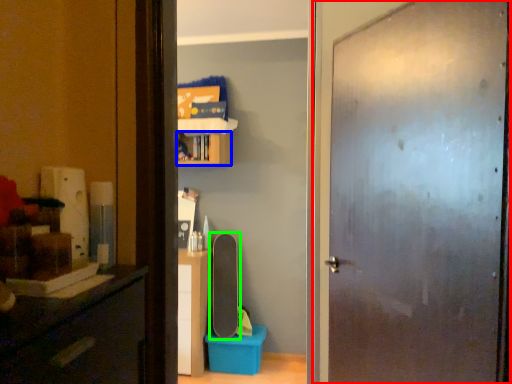
Question: Based on their relative distances, which object is nearer to door (highlighted by a red box)? Choose from cabinet (highlighted by a blue box) and skateboard (highlighted by a green box).

Choices:
 (A) cabinet
 (B) skateboard

Answer: (A)